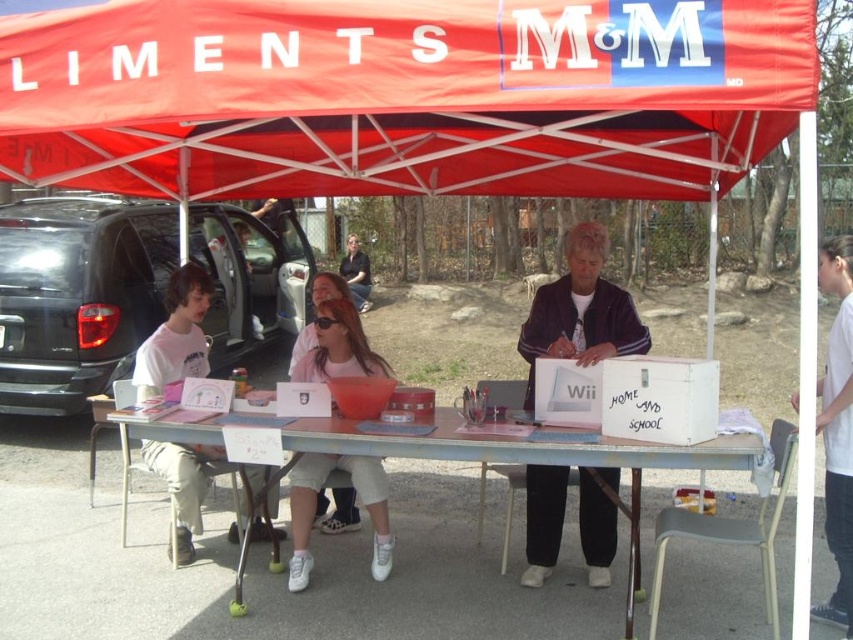
Question: Among these objects, which one is farthest from the camera?

Choices:
 (A) matte pink shirt at center
 (B) red fabric canopy at upper center

Answer: (A)

Question: Is black matte van at left bigger than pink plastic table at center?

Choices:
 (A) yes
 (B) no

Answer: (B)

Question: Among these points, which one is nearest to the camera?

Choices:
 (A) (843, 316)
 (B) (352, 353)

Answer: (A)

Question: Is black fleece jacket at center closer to the viewer compared to white cotton shirt at right?

Choices:
 (A) yes
 (B) no

Answer: (B)

Question: Can you confirm if black matte van at left is positioned to the left of matte pink shirt at center?

Choices:
 (A) yes
 (B) no

Answer: (A)

Question: Which object appears farthest from the camera in this image?

Choices:
 (A) pink fabric shirt at center
 (B) red fabric canopy at upper center
 (C) black matte van at left
 (D) pink plastic table at center

Answer: (C)